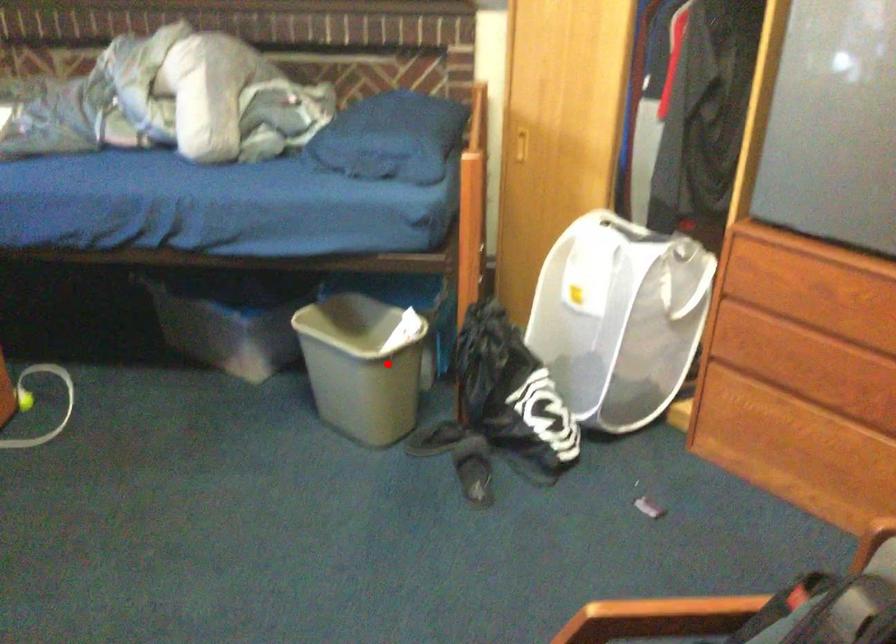
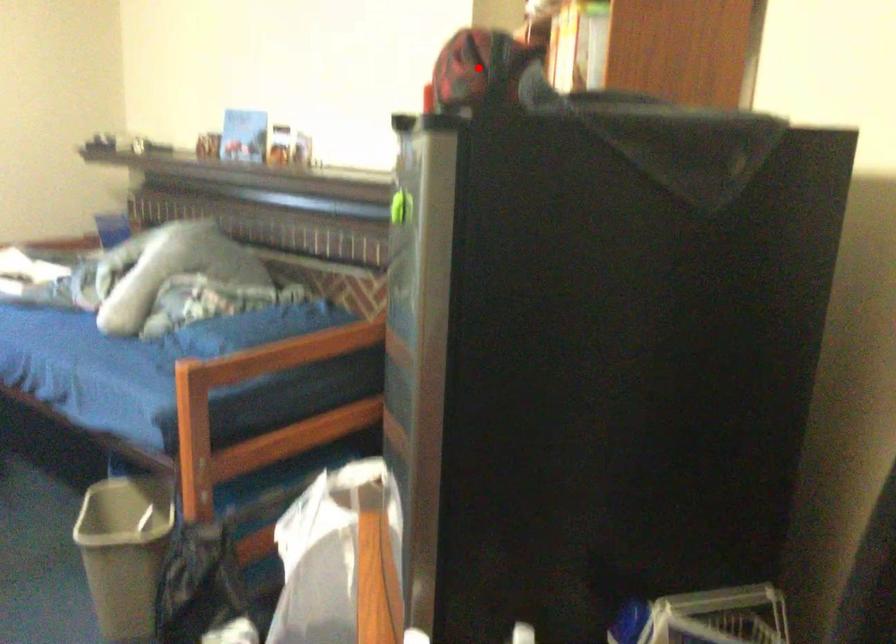
I am providing you with two images of the same scene from different viewpoints. A red point is marked on the first image and another point is marked on the second image. Is the marked point in image1 the same physical position as the marked point in image2?

No